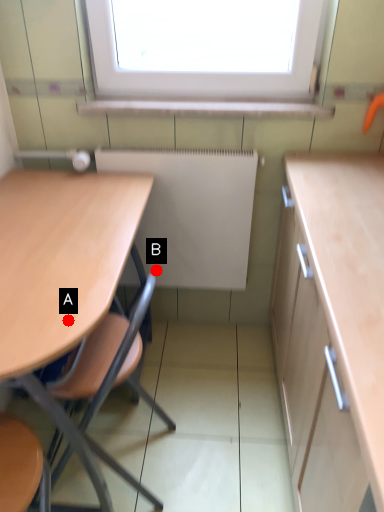
Question: Two points are circled on the image, labeled by A and B beside each circle. Which point is farther to the camera?

Choices:
 (A) A is further
 (B) B is further

Answer: (B)